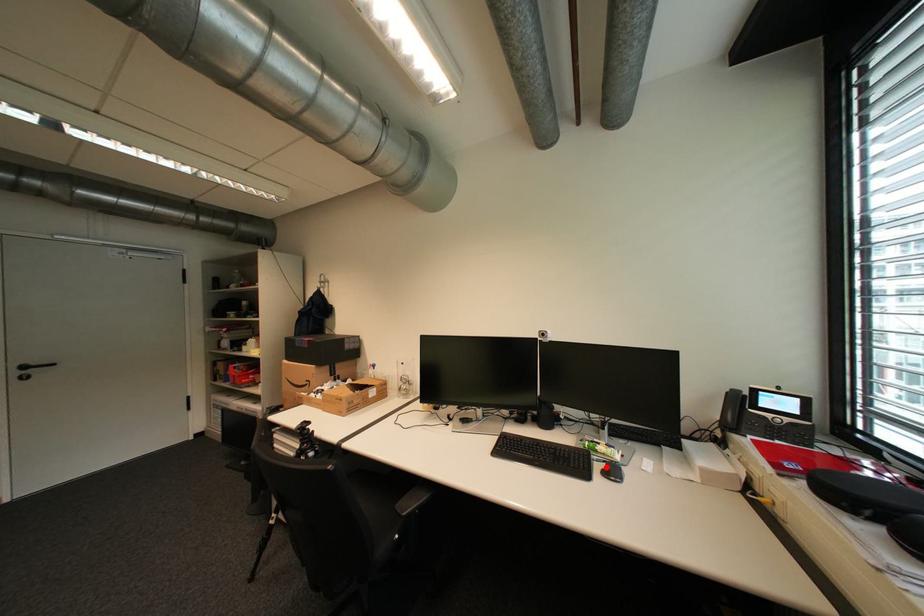
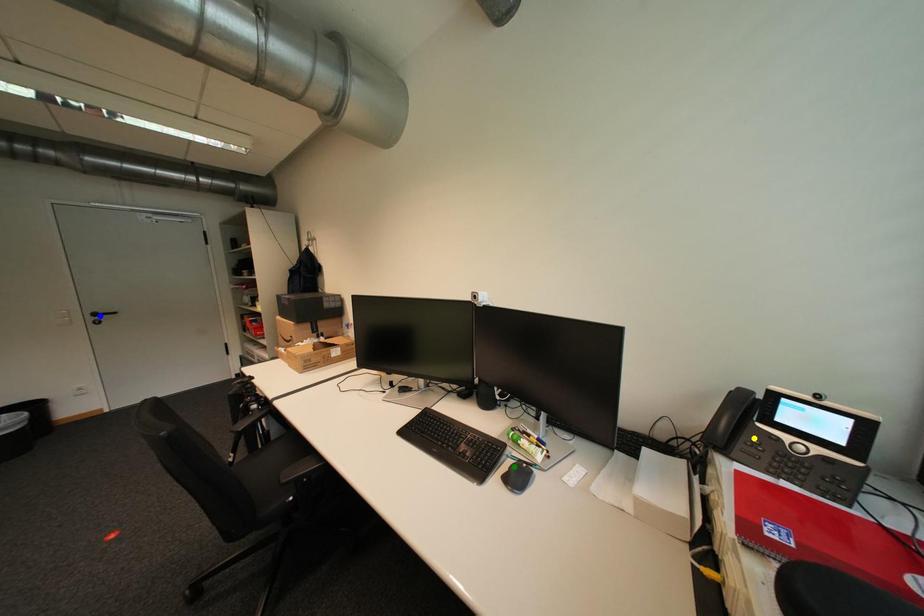
Question: I am providing you with two images of the same scene from different viewpoints. A red point is marked on the first image. You are given multiple points on the second image. In image 2, which mark is for the same physical point as the one in image 1?

Choices:
 (A) green point
 (B) yellow point
 (C) blue point

Answer: (A)